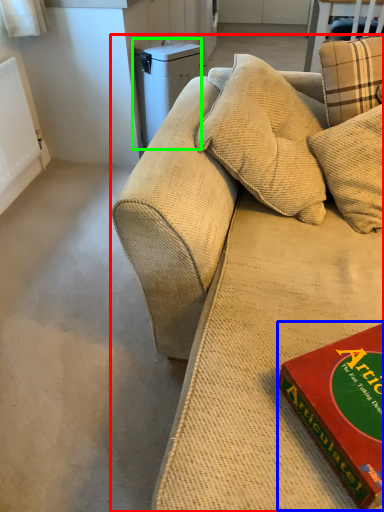
Question: Considering the real-world distances, which object is closest to studio couch (highlighted by a red box)? paperback book (highlighted by a blue box) or appliance (highlighted by a green box).

Choices:
 (A) paperback book
 (B) appliance

Answer: (A)